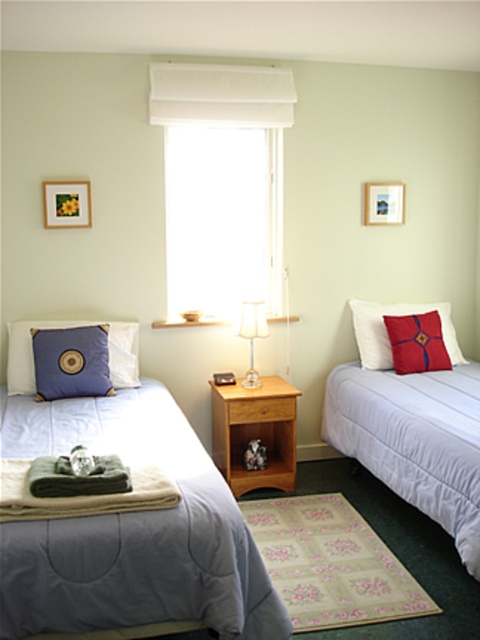
Does white fabric window at center appear on the left side of white fabric lamp at center?

Indeed, white fabric window at center is positioned on the left side of white fabric lamp at center.

The image size is (480, 640). What do you see at coordinates (223, 182) in the screenshot?
I see `white fabric window at center` at bounding box center [223, 182].

Does point (199, 182) come farther from viewer compared to point (252, 364)?

That is True.

Find the location of `white fabric window at center`. white fabric window at center is located at coordinates (223, 182).

Does red velvet cushion at right have a larger size compared to white fabric lamp at center?

Actually, red velvet cushion at right might be smaller than white fabric lamp at center.

Does red velvet cushion at right have a lesser height compared to white fabric lamp at center?

Indeed, red velvet cushion at right has a lesser height compared to white fabric lamp at center.

This screenshot has width=480, height=640. I want to click on red velvet cushion at right, so click(x=417, y=342).

Identify the location of red velvet cushion at right. (417, 342).

At what (x,y) coordinates should I click in order to perform the action: click on matte blue pillow at left. Please return your answer as a coordinate pair (x, y). This screenshot has height=640, width=480. Looking at the image, I should click on (28, 352).

Does matte blue pillow at left appear under red velvet cushion at right?

Correct, matte blue pillow at left is located below red velvet cushion at right.

Does point (52, 321) lie behind point (440, 356)?

No.

Identify the location of matte blue pillow at left. This screenshot has width=480, height=640. (28, 352).